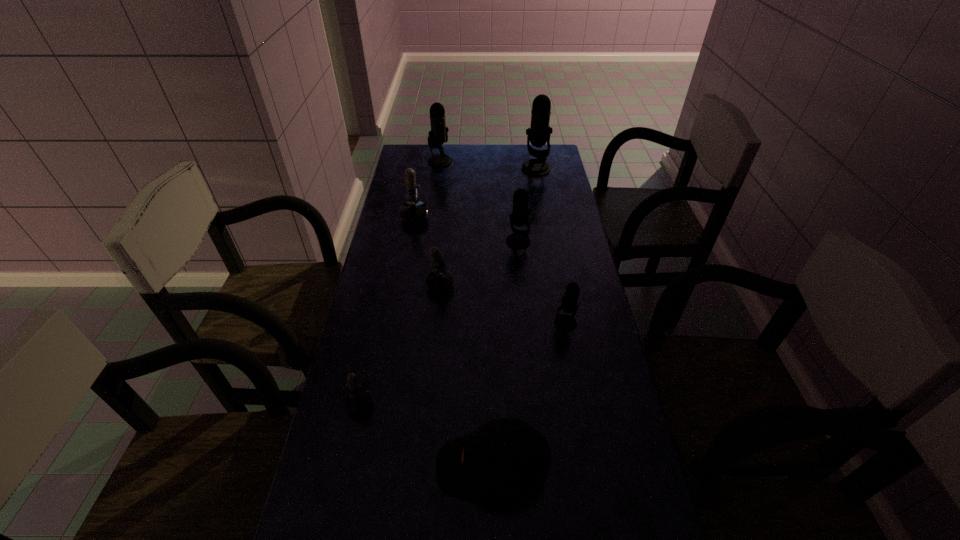
Image resolution: width=960 pixels, height=540 pixels. In the image, there is a desktop. Identify the location of vacant space at the right edge. (535, 227).

You are a GUI agent. You are given a task and a screenshot of the screen. Output one action in this format:
    pyautogui.click(x=<x>, y=<y>)
    Task: Click on the free region at the far left corner of the desktop
    The height and width of the screenshot is (540, 960).
    Given the screenshot: What is the action you would take?
    pyautogui.click(x=413, y=165)

At what (x,y) coordinates should I click in order to perform the action: click on vacant area between the fourth nearest object and the fourth nearest microphone. Please return your answer as a coordinate pair (x, y). This screenshot has width=960, height=540. Looking at the image, I should click on (469, 264).

Find the location of a particular element. Image resolution: width=960 pixels, height=540 pixels. vacant space that is in between the sixth farthest microphone and the second tallest microphone is located at coordinates (503, 242).

This screenshot has width=960, height=540. I want to click on empty location between the baseball cap and the biggest black microphone, so click(x=514, y=318).

Locate an element on the screen. This screenshot has height=540, width=960. vacant space that is in between the third nearest microphone and the biggest white microphone is located at coordinates (419, 246).

Locate an element on the screen. free spot between the smallest black microphone and the biggest white microphone is located at coordinates (491, 265).

In order to click on object that is the sixth closest to the tallest microphone in this screenshot , I will do `click(358, 400)`.

Locate an element on the screen. The width and height of the screenshot is (960, 540). object that stands as the second closest to the second farthest white microphone is located at coordinates (358, 400).

Identify which microphone is the fourth closest to the biggest black microphone. Please provide its 2D coordinates. Your answer should be formatted as a tuple, i.e. [(x, y)], where the tuple contains the x and y coordinates of a point satisfying the conditions above.

[(439, 280)]